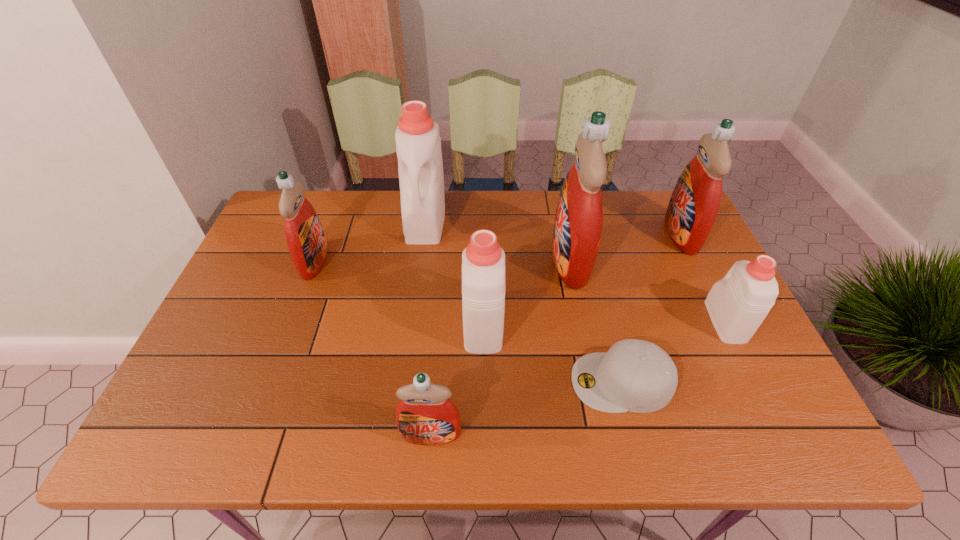
Where is `free space between the smallest red detergent and the cap`? free space between the smallest red detergent and the cap is located at coordinates (526, 408).

This screenshot has width=960, height=540. I want to click on free spot between the leftmost red detergent and the farthest white detergent, so click(x=370, y=241).

Locate an element on the screen. Image resolution: width=960 pixels, height=540 pixels. free point between the second red detergent from left to right and the second white detergent from right to left is located at coordinates (457, 379).

You are a GUI agent. You are given a task and a screenshot of the screen. Output one action in this format:
    pyautogui.click(x=<x>, y=<y>)
    Task: Click on the vacant space that's between the second white detergent from left to right and the tallest object
    Image resolution: width=960 pixels, height=540 pixels.
    Given the screenshot: What is the action you would take?
    pyautogui.click(x=527, y=291)

Identify the location of unoccupied position between the biggest white detergent and the nearest red detergent. This screenshot has width=960, height=540. (428, 327).

I want to click on free area in between the second biggest white detergent and the cap, so click(553, 352).

The width and height of the screenshot is (960, 540). I want to click on the seventh closest object to the tallest detergent, so click(306, 242).

Identify which object is the fourth closest to the rightmost white detergent. Please provide its 2D coordinates. Your answer should be formatted as a tuple, i.e. [(x, y)], where the tuple contains the x and y coordinates of a point satisfying the conditions above.

[(483, 261)]

Where is `detergent that can be found as the third closest to the third biggest red detergent`? The width and height of the screenshot is (960, 540). detergent that can be found as the third closest to the third biggest red detergent is located at coordinates (425, 415).

Identify which detergent is located as the fifth nearest to the third smallest red detergent. Please provide its 2D coordinates. Your answer should be formatted as a tuple, i.e. [(x, y)], where the tuple contains the x and y coordinates of a point satisfying the conditions above.

[(425, 415)]